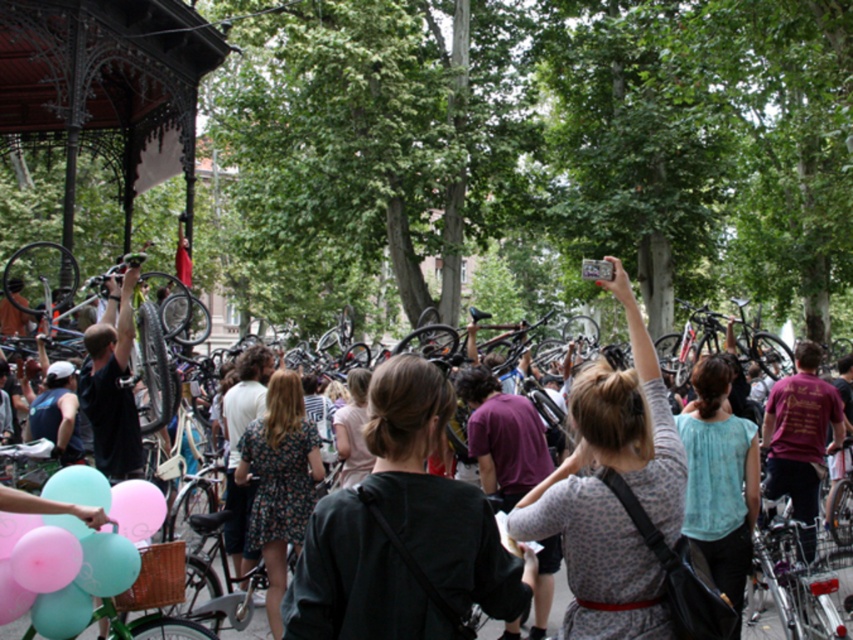
Is dark green sweater at center bigger than shiny silver bicycle at center?

No.

Who is higher up, dark green sweater at center or shiny silver bicycle at center?

dark green sweater at center

At what (x,y) coordinates should I click in order to perform the action: click on dark green sweater at center. Please return your answer as a coordinate pair (x, y). Looking at the image, I should click on (402, 532).

This screenshot has height=640, width=853. I want to click on dark green sweater at center, so click(x=402, y=532).

Does maroon cotton t-shirt at center appear on the right side of matte black t-shirt at center?

Yes, maroon cotton t-shirt at center is to the right of matte black t-shirt at center.

Is maroon cotton t-shirt at center shorter than matte black t-shirt at center?

Incorrect, maroon cotton t-shirt at center's height does not fall short of matte black t-shirt at center's.

What do you see at coordinates (799, 432) in the screenshot? I see `maroon cotton t-shirt at center` at bounding box center [799, 432].

This screenshot has width=853, height=640. In order to click on maroon cotton t-shirt at center in this screenshot , I will do `click(799, 432)`.

Is point (271, 560) positioned after point (751, 628)?

That is True.

Between floral dress at center and shiny silver bicycle at center, which one is positioned higher?

floral dress at center is above.

Which is in front, point (289, 442) or point (788, 611)?

Positioned in front is point (788, 611).

Where is `floral dress at center`? The height and width of the screenshot is (640, 853). floral dress at center is located at coordinates (279, 481).